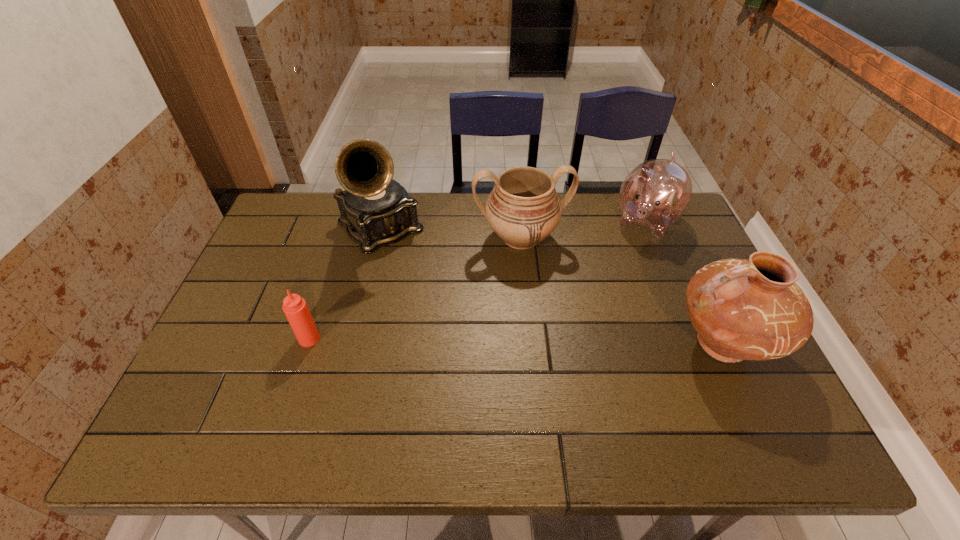
You are a GUI agent. You are given a task and a screenshot of the screen. Output one action in this format:
    pyautogui.click(x=<x>, y=<y>)
    Task: Click on the free space on the desktop that is between the Tabasco sauce and the pottery and is positioned on the front-facing side of the third object from left to right
    The image size is (960, 540).
    Given the screenshot: What is the action you would take?
    pyautogui.click(x=547, y=342)

Locate an element on the screen. This screenshot has width=960, height=540. vacant spot on the desktop that is between the Tabasco sauce and the pottery and is positioned on the front facing side of the piggy bank is located at coordinates (569, 342).

The height and width of the screenshot is (540, 960). I want to click on free space on the desktop that is between the shortest object and the pottery and is positioned on the horn of the tallest object, so click(x=479, y=341).